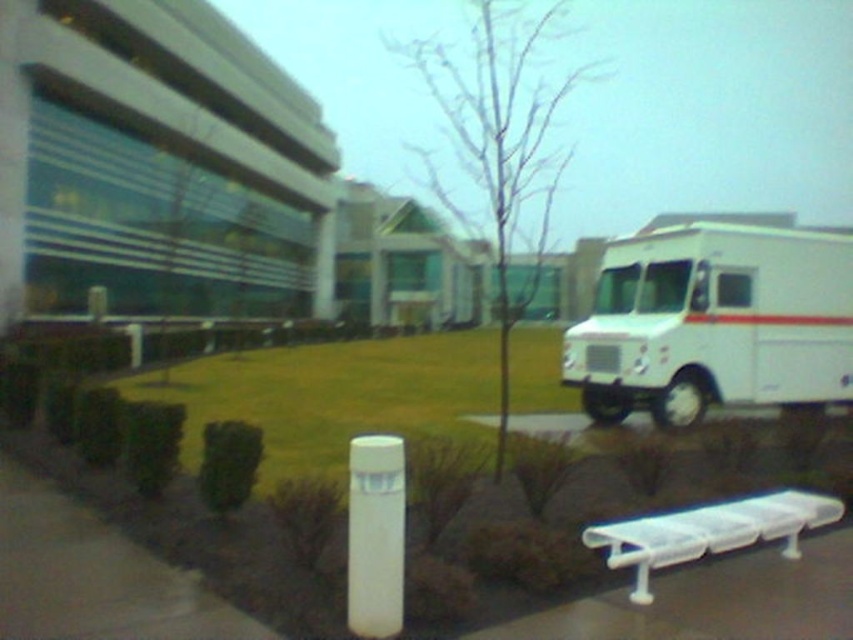
Between white matte truck at right and white plastic bench at lower right, which one has more height?

white matte truck at right is taller.

Does point (697, 310) come closer to viewer compared to point (694, 536)?

No.

This screenshot has height=640, width=853. In order to click on white matte truck at right in this screenshot , I will do `click(714, 323)`.